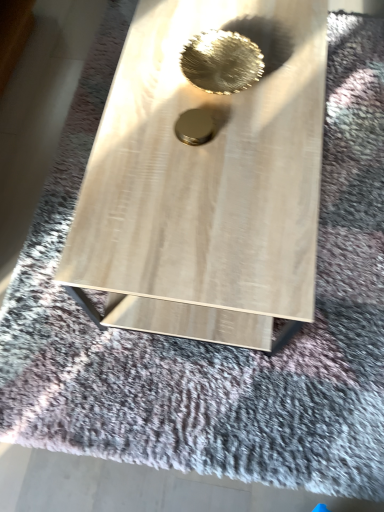
Identify the location of vacant space situated on the left part of gold metallic circle at center, arranged as the first hole when ordered from the bottom. The width and height of the screenshot is (384, 512). (136, 134).